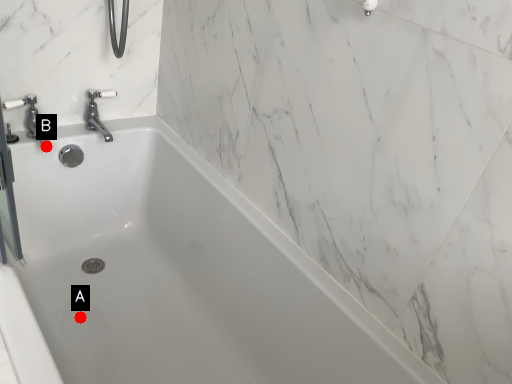
Question: Two points are circled on the image, labeled by A and B beside each circle. Among these points, which one is nearest to the camera?

Choices:
 (A) A is closer
 (B) B is closer

Answer: (A)